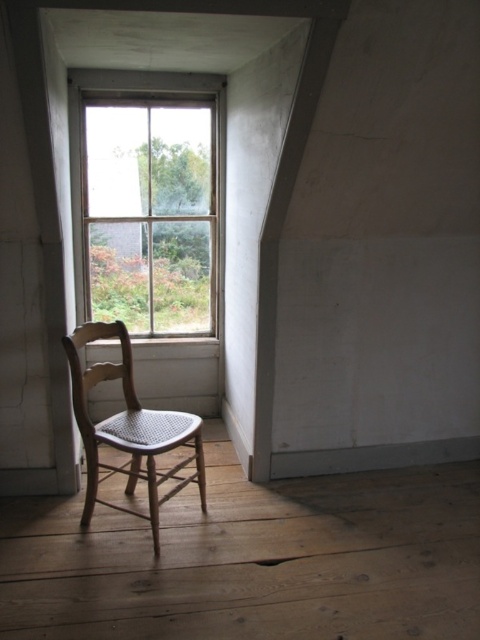
Based on the photo, who is more distant from viewer, (84, 260) or (126, 451)?

Positioned behind is point (84, 260).

Who is higher up, clear glass window at center or light wood cane chair at left?

Positioned higher is clear glass window at center.

Which is in front, point (163, 314) or point (95, 333)?

Point (95, 333)

This screenshot has width=480, height=640. Identify the location of clear glass window at center. (147, 204).